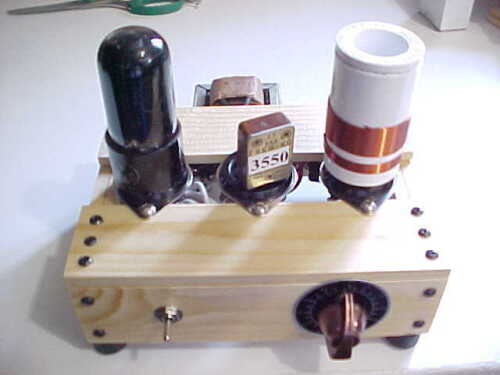
What are the coordinates of `top back of wooden box` in the screenshot? It's located at (208, 125).